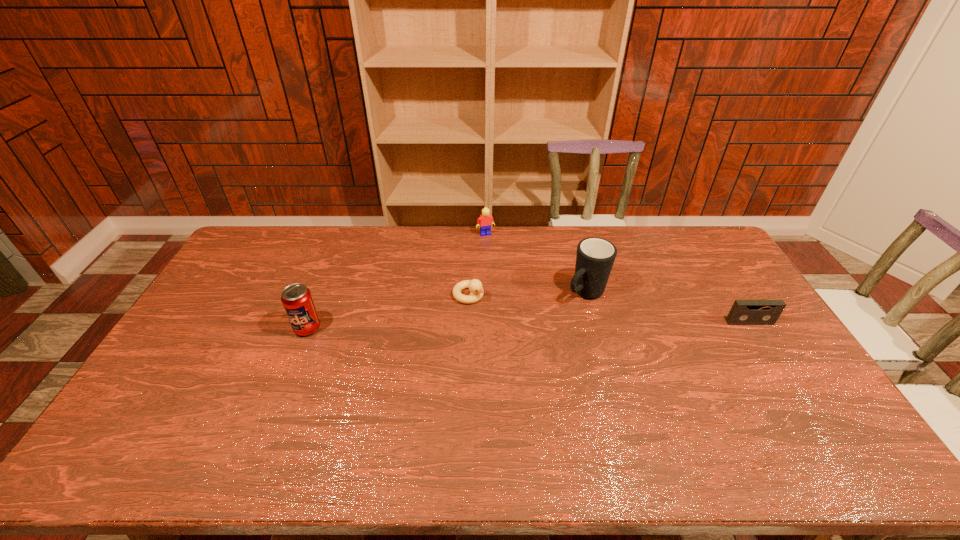
At what (x,y) coordinates should I click in order to perform the action: click on free spot on the desktop that is between the second tallest object and the videotape and is positioned on the side of the mug with the handle. Please return your answer as a coordinate pair (x, y). The height and width of the screenshot is (540, 960). Looking at the image, I should click on (547, 325).

This screenshot has width=960, height=540. Find the location of `vacant space on the desktop that is between the leftmost object and the rightmost object and is positioned at the beak of the duckling`. vacant space on the desktop that is between the leftmost object and the rightmost object and is positioned at the beak of the duckling is located at coordinates (517, 325).

Identify the location of vacant space on the desktop that is between the leftmost object and the videotape and is positioned on the front-facing side of the Lego. The height and width of the screenshot is (540, 960). (527, 325).